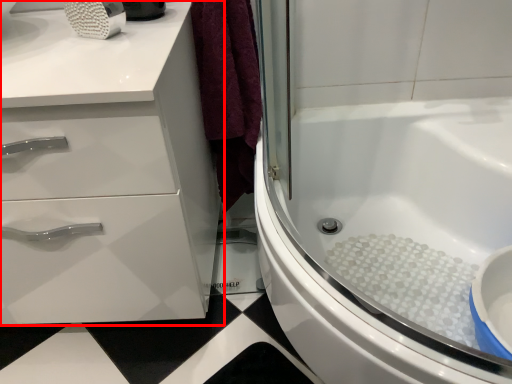
Question: Where is bathroom cabinet (annotated by the red box) located in relation to bath in the image?

Choices:
 (A) right
 (B) left

Answer: (B)